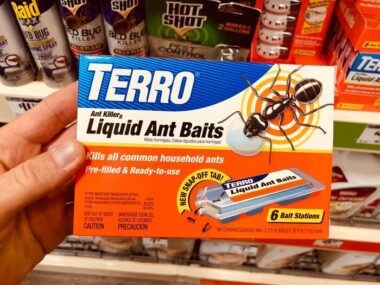
Where is `wall under shelf, left lower corner`? This screenshot has width=380, height=285. wall under shelf, left lower corner is located at coordinates (61, 280).